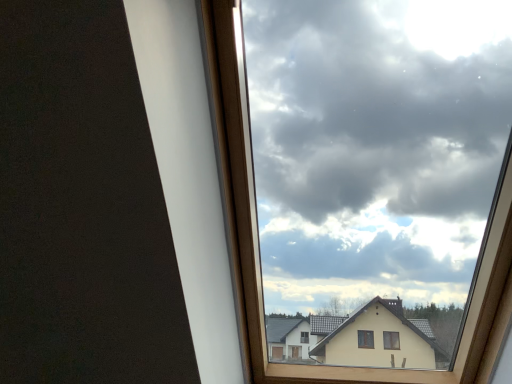
This screenshot has width=512, height=384. What do you see at coordinates (379, 104) in the screenshot?
I see `cloudy sky at upper center` at bounding box center [379, 104].

At what (x,y) coordinates should I click in order to perform the action: click on cloudy sky at upper center. Please return your answer as a coordinate pair (x, y). Image resolution: width=512 pixels, height=384 pixels. Looking at the image, I should click on (379, 104).

In order to face cloudy sky at upper center, should I rotate leftwards or rightwards?

It's best to rotate right around 17.946 degrees.

Where is `cloudy sky at upper center`? Image resolution: width=512 pixels, height=384 pixels. cloudy sky at upper center is located at coordinates (379, 104).